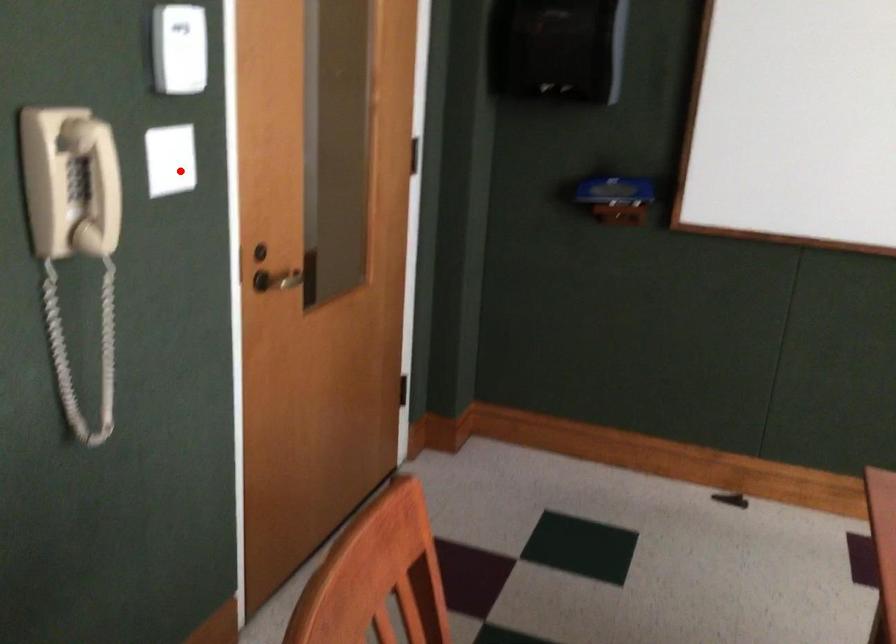
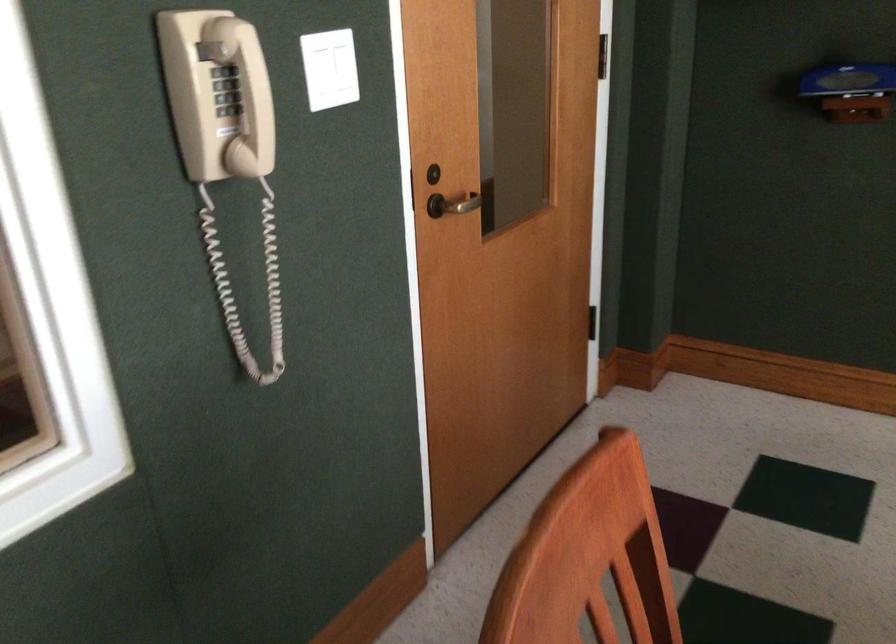
Question: I am providing you with two images of the same scene from different viewpoints. In image1, a red point is highlighted. Considering the same 3D point in image2, which of the following is correct?

Choices:
 (A) It is closer
 (B) It is farther

Answer: (A)